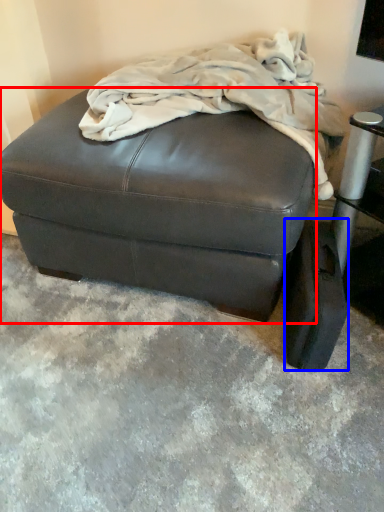
Question: Which object is closer to the camera taking this photo, furniture (highlighted by a red box) or pad (highlighted by a blue box)?

Choices:
 (A) furniture
 (B) pad

Answer: (A)